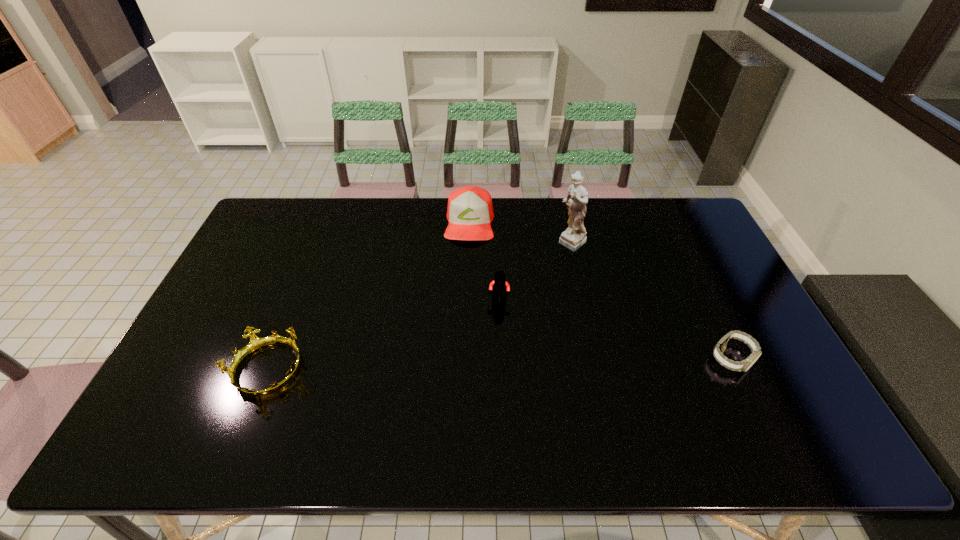
You are a GUI agent. You are given a task and a screenshot of the screen. Output one action in this format:
    pyautogui.click(x=<x>, y=<y>)
    Task: Click on the vacant region located on the front-facing side of the baseball cap
    Image resolution: width=960 pixels, height=540 pixels.
    Given the screenshot: What is the action you would take?
    pyautogui.click(x=468, y=265)

At what (x,y) coordinates should I click in order to perform the action: click on vacant space situated on the front-facing side of the baseball cap. Please return your answer as a coordinate pair (x, y). This screenshot has width=960, height=540. Looking at the image, I should click on (468, 259).

You are a GUI agent. You are given a task and a screenshot of the screen. Output one action in this format:
    pyautogui.click(x=<x>, y=<y>)
    Task: Click on the vacant space positioned 0.200m on the front-facing side of the baseball cap
    
    Given the screenshot: What is the action you would take?
    pyautogui.click(x=466, y=287)

Where is `vacant space located on the front-facing side of the figurine`? Image resolution: width=960 pixels, height=540 pixels. vacant space located on the front-facing side of the figurine is located at coordinates (529, 286).

Identify the location of free region located on the front-facing side of the figurine. (496, 316).

Locate an element on the screen. vacant space located on the front-facing side of the figurine is located at coordinates (553, 264).

Locate an element on the screen. The image size is (960, 540). baseball cap present at the far edge is located at coordinates (470, 211).

Find the location of `figurine at the far edge`. figurine at the far edge is located at coordinates (574, 236).

Find the location of a particular element. object located in the near edge section of the desktop is located at coordinates (256, 343).

Where is `object positioned at the left edge`? object positioned at the left edge is located at coordinates (256, 343).